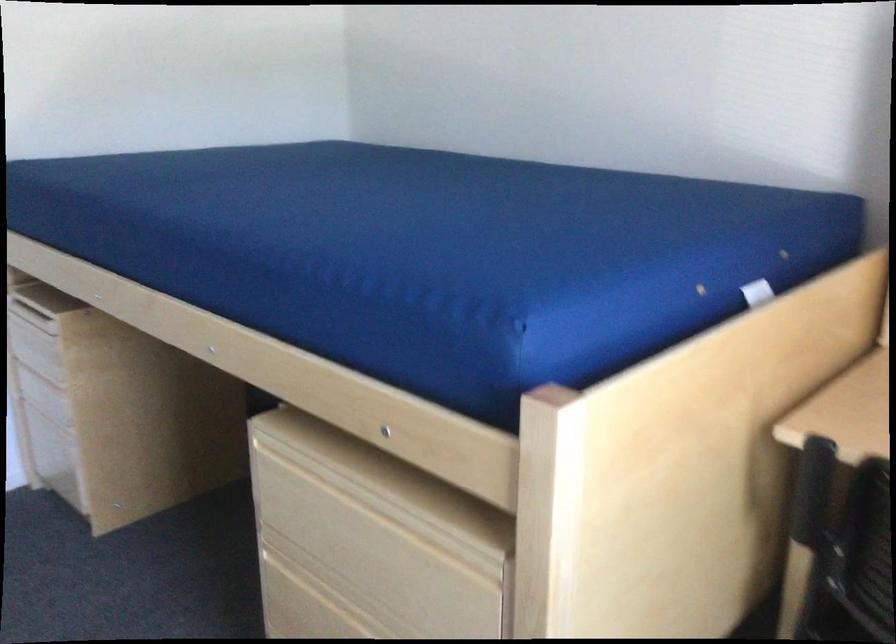
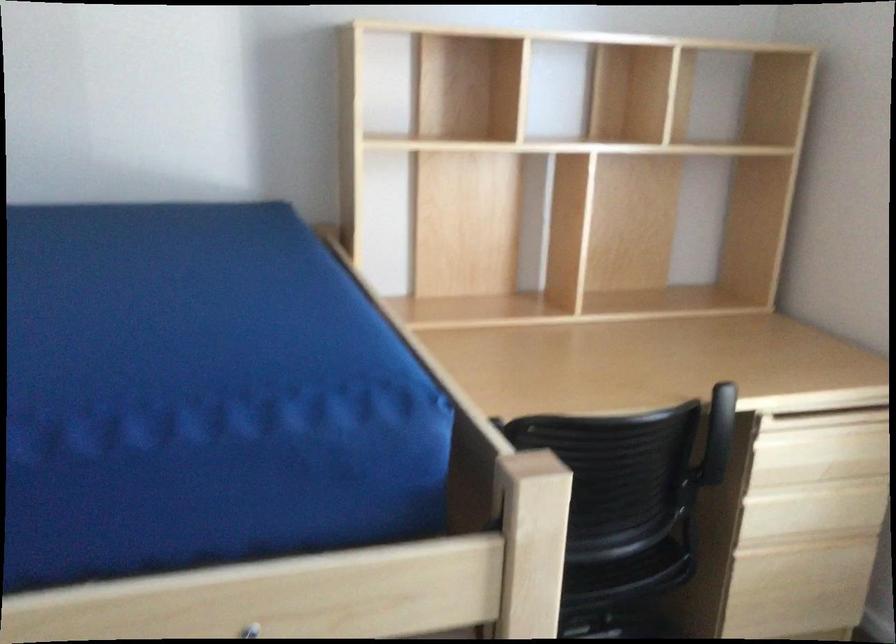
The point at (394, 433) is marked in the first image. Where is the corresponding point in the second image?

(250, 630)